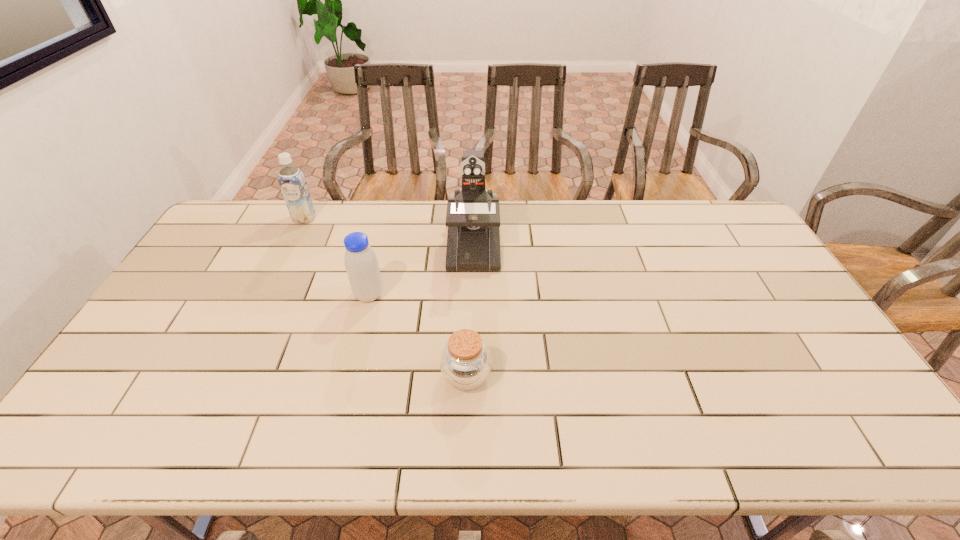
Where is `vacant region that satisfies the following two spatial constraints: 1. on the label of the left soya milk; 2. on the left side of the second shortest object`? The width and height of the screenshot is (960, 540). vacant region that satisfies the following two spatial constraints: 1. on the label of the left soya milk; 2. on the left side of the second shortest object is located at coordinates (268, 295).